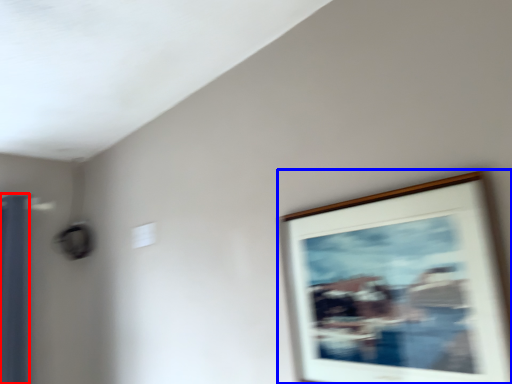
Question: Which point is closer to the camera, curtain (highlighted by a red box) or picture frame (highlighted by a blue box)?

Choices:
 (A) curtain
 (B) picture frame

Answer: (B)